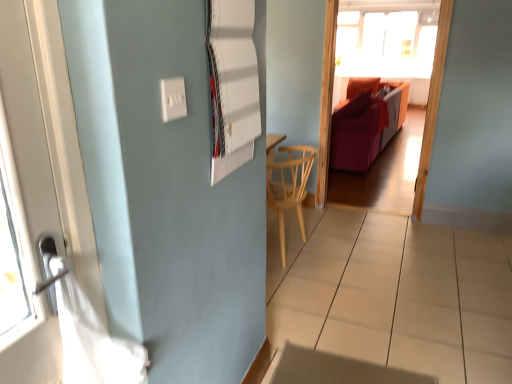
Locate an element on the screen. The width and height of the screenshot is (512, 384). white plastic electric outlet at upper center is located at coordinates (173, 99).

Describe the element at coordinates (232, 84) in the screenshot. I see `white paperboard at upper center` at that location.

Find the location of a particular element. The image size is (512, 384). velvet red sofa at center is located at coordinates (366, 123).

Locate an element on the screen. white plastic electric outlet at upper center is located at coordinates (173, 99).

From a real-world perspective, is light wood chair at center physically above velvet red sofa at center?

No, from a real-world perspective, light wood chair at center is not on top of velvet red sofa at center.

Can you tell me how much light wood chair at center and velvet red sofa at center differ in facing direction?

There is a 176-degree angle between the facing directions of light wood chair at center and velvet red sofa at center.

Does light wood chair at center have a greater height compared to velvet red sofa at center?

Incorrect, the height of light wood chair at center is not larger of that of velvet red sofa at center.

From the image's perspective, which one is positioned higher, light wood chair at center or velvet red sofa at center?

velvet red sofa at center is shown above in the image.

Between white paperboard at upper center and velvet orange couch at center, which one has smaller size?

white paperboard at upper center.

Does white paperboard at upper center appear on the right side of velvet orange couch at center?

No.

What's the angular difference between white paperboard at upper center and velvet orange couch at center's facing directions?

The angular difference between white paperboard at upper center and velvet orange couch at center is 89.3 degrees.

From a real-world perspective, which object stands above the other?

white paperboard at upper center, from a real-world perspective.

Visually, is light wood chair at center positioned to the left or to the right of white glossy tile at lower center?

Clearly, light wood chair at center is on the left of white glossy tile at lower center in the image.

Between light wood chair at center and white glossy tile at lower center, which one has more height?

light wood chair at center is taller.

Are light wood chair at center and white glossy tile at lower center located far from each other?

No.

This screenshot has height=384, width=512. What are the coordinates of `bulletin board that appears in front of the velvet orange couch at center` in the screenshot? It's located at point(232,84).

Does velvet orange couch at center have a smaller size compared to white paperboard at upper center?

Incorrect, velvet orange couch at center is not smaller in size than white paperboard at upper center.

What's the angular difference between velvet orange couch at center and white paperboard at upper center's facing directions?

The angular difference between velvet orange couch at center and white paperboard at upper center is 89.3 degrees.

Considering the sizes of velvet orange couch at center and white paperboard at upper center in the image, is velvet orange couch at center taller or shorter than white paperboard at upper center?

velvet orange couch at center is taller than white paperboard at upper center.

Is light wood chair at center oriented away from transparent glass window at upper center?

No.

In terms of width, does light wood chair at center look wider or thinner when compared to transparent glass window at upper center?

Considering their sizes, light wood chair at center looks broader than transparent glass window at upper center.

Looking at this image, from a real-world perspective, which is physically above, light wood chair at center or transparent glass window at upper center?

transparent glass window at upper center is physically above.

From a real-world perspective, is velvet orange couch at center above or below velvet red sofa at center?

Clearly, from a real-world perspective, velvet orange couch at center is above velvet red sofa at center.

How distant is velvet orange couch at center from velvet red sofa at center?

The distance of velvet orange couch at center from velvet red sofa at center is 1.19 meters.

Considering the relative sizes of velvet orange couch at center and velvet red sofa at center in the image provided, is velvet orange couch at center wider than velvet red sofa at center?

No, velvet orange couch at center is not wider than velvet red sofa at center.

Locate an element on the screen. The height and width of the screenshot is (384, 512). furniture below the velvet orange couch at center (from a real-world perspective) is located at coordinates (366, 123).

Is velvet red sofa at center directly adjacent to light wood chair at center?

No, velvet red sofa at center is not touching light wood chair at center.

Can you tell me how much velvet red sofa at center and light wood chair at center differ in facing direction?

The angle between the facing direction of velvet red sofa at center and the facing direction of light wood chair at center is 176 degrees.

Looking at their sizes, would you say velvet red sofa at center is wider or thinner than light wood chair at center?

velvet red sofa at center is wider than light wood chair at center.

Can you confirm if velvet red sofa at center is positioned to the right of light wood chair at center?

Indeed, velvet red sofa at center is positioned on the right side of light wood chair at center.

Locate an element on the screen. chair on the left of velvet red sofa at center is located at coordinates (289, 187).

This screenshot has width=512, height=384. What are the coordinates of `screen door that appears behind the white paperboard at upper center` in the screenshot? It's located at (326, 102).

Which object lies further to the anchor point velvet red sofa at center, light wood chair at center or transparent glass window at upper center?

light wood chair at center.

Estimate the real-world distances between objects in this image. Which object is further from white paperboard at upper center, velvet orange couch at center or transparent glass window at upper center?

The object further to white paperboard at upper center is transparent glass window at upper center.

When comparing their distances from velvet orange couch at center, does transparent glass window at upper center or white paperboard at upper center seem further?

transparent glass window at upper center.

Looking at the image, which one is located closer to velvet red sofa at center, white glossy tile at lower center or light wood chair at center?

white glossy tile at lower center lies closer to velvet red sofa at center than the other object.

Considering their positions, is transparent glass window at upper center positioned further to velvet orange couch at center than white plastic electric outlet at upper center?

The object further to velvet orange couch at center is transparent glass window at upper center.

Considering their positions, is velvet orange couch at center positioned closer to velvet red sofa at center than white paperboard at upper center?

velvet orange couch at center lies closer to velvet red sofa at center than the other object.

From the image, which object appears to be nearer to white plastic electric outlet at upper center, velvet orange couch at center or white paperboard at upper center?

Among the two, white paperboard at upper center is located nearer to white plastic electric outlet at upper center.

When comparing their distances from white glossy tile at lower center, does velvet red sofa at center or light wood chair at center seem further?

velvet red sofa at center is positioned further to the anchor white glossy tile at lower center.

Locate an element on the screen. The height and width of the screenshot is (384, 512). screen door between light wood chair at center and transparent glass window at upper center from front to back is located at coordinates (326, 102).

The image size is (512, 384). In order to click on chair positioned between white glossy tile at lower center and velvet red sofa at center from near to far in this screenshot , I will do click(289, 187).

I want to click on chair located between white glossy tile at lower center and velvet orange couch at center in the depth direction, so click(x=289, y=187).

This screenshot has height=384, width=512. In order to click on electric outlet between white paperboard at upper center and white glossy tile at lower center vertically in this screenshot , I will do `click(173, 99)`.